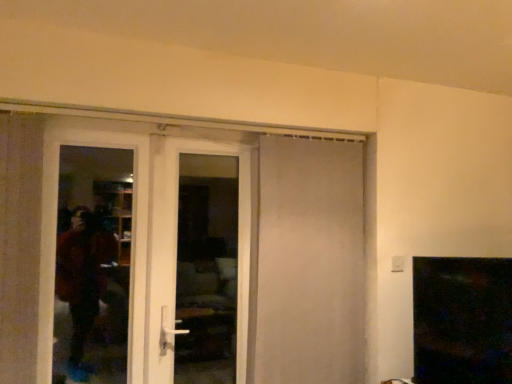
Question: Should I look upward or downward to see white glossy door at left, placed as the first door when sorted from left to right?

Choices:
 (A) up
 (B) down

Answer: (B)

Question: Is white glossy door at left, placed as the first door when sorted from left to right, wider than white glossy door at center, acting as the second door starting from the left?

Choices:
 (A) no
 (B) yes

Answer: (A)

Question: Is white glossy door at left, placed as the first door when sorted from left to right, facing away from white glossy door at center, which is the second door in right-to-left order?

Choices:
 (A) yes
 (B) no

Answer: (A)

Question: Does white glossy door at left, marked as the 3th door in a right-to-left arrangement, contain white glossy door at center, acting as the second door starting from the left?

Choices:
 (A) no
 (B) yes

Answer: (B)

Question: From the image's perspective, does white glossy door at left, placed as the first door when sorted from left to right, appear higher than white glossy door at center, acting as the second door starting from the left?

Choices:
 (A) no
 (B) yes

Answer: (A)

Question: Can you confirm if white glossy door at left, marked as the 3th door in a right-to-left arrangement, is taller than white glossy door at center, acting as the second door starting from the left?

Choices:
 (A) yes
 (B) no

Answer: (B)

Question: Is white glossy door at left, marked as the 3th door in a right-to-left arrangement, shorter than white glossy door at center, which is the second door in right-to-left order?

Choices:
 (A) yes
 (B) no

Answer: (A)

Question: Is white glossy door at left, marked as the 3th door in a right-to-left arrangement, not close to transparent glass screen door at left?

Choices:
 (A) no
 (B) yes

Answer: (B)

Question: Is white glossy door at left, marked as the 3th door in a right-to-left arrangement, closer to the viewer compared to transparent glass screen door at left?

Choices:
 (A) no
 (B) yes

Answer: (B)

Question: Considering the relative positions of white glossy door at left, marked as the 3th door in a right-to-left arrangement, and transparent glass screen door at left in the image provided, is white glossy door at left, marked as the 3th door in a right-to-left arrangement, to the right of transparent glass screen door at left from the viewer's perspective?

Choices:
 (A) yes
 (B) no

Answer: (A)

Question: From a real-world perspective, is white glossy door at left, placed as the first door when sorted from left to right, located beneath transparent glass screen door at left?

Choices:
 (A) yes
 (B) no

Answer: (A)

Question: Is white glossy door at left, placed as the first door when sorted from left to right, to the left of transparent glass screen door at left from the viewer's perspective?

Choices:
 (A) no
 (B) yes

Answer: (A)

Question: Is white glossy door at left, marked as the 3th door in a right-to-left arrangement, wider than transparent glass screen door at left?

Choices:
 (A) no
 (B) yes

Answer: (B)

Question: Is white glossy door at left, marked as the 3th door in a right-to-left arrangement, beside white matte door at center, acting as the 1th door starting from the right?

Choices:
 (A) no
 (B) yes

Answer: (A)